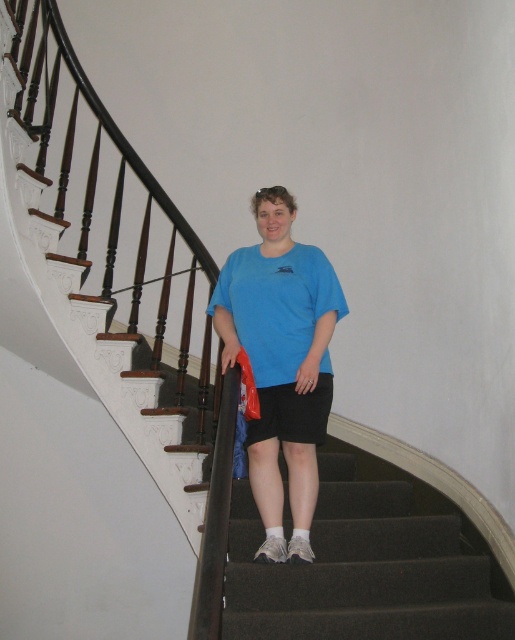
Question: Can you confirm if dark gray carpet at center is bigger than blue matte t-shirt at center?

Choices:
 (A) yes
 (B) no

Answer: (A)

Question: Estimate the real-world distances between objects in this image. Which object is farther from the matte blue t-shirt at center?

Choices:
 (A) dark gray carpet at center
 (B) blue matte t-shirt at center
 (C) black cotton shorts at center

Answer: (A)

Question: Does dark gray carpet at center come behind matte blue t-shirt at center?

Choices:
 (A) no
 (B) yes

Answer: (A)

Question: Among these points, which one is nearest to the camera?

Choices:
 (A) (248, 321)
 (B) (409, 515)
 (C) (284, 460)

Answer: (A)

Question: Which object is positioned farthest from the blue matte t-shirt at center?

Choices:
 (A) black cotton shorts at center
 (B) matte blue t-shirt at center
 (C) dark gray carpet at center

Answer: (C)

Question: Is dark gray carpet at center positioned in front of matte blue t-shirt at center?

Choices:
 (A) yes
 (B) no

Answer: (A)